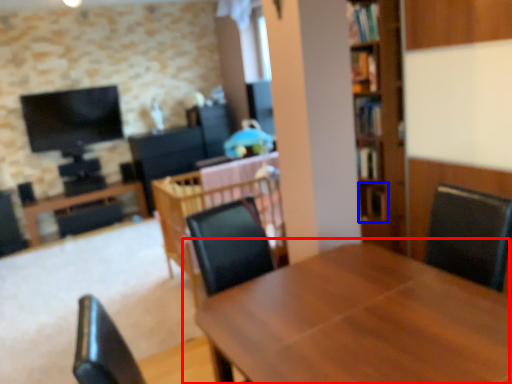
Question: Among these objects, which one is nearest to the camera, table (highlighted by a red box) or shelf (highlighted by a blue box)?

Choices:
 (A) table
 (B) shelf

Answer: (A)